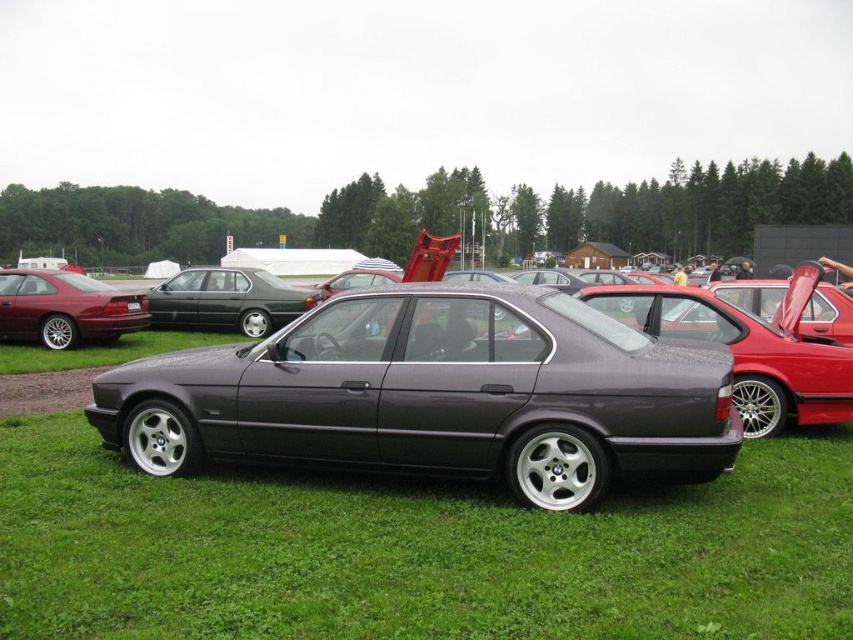
Question: Is satin metallic sedan at center to the right of satin black sedan at center from the viewer's perspective?

Choices:
 (A) yes
 (B) no

Answer: (A)

Question: Does shiny red car at left have a larger size compared to satin black sedan at center?

Choices:
 (A) no
 (B) yes

Answer: (A)

Question: Which object is the closest to the shiny red car at left?

Choices:
 (A) satin black sedan at center
 (B) satin metallic sedan at center

Answer: (A)

Question: Which object is closer to the camera taking this photo?

Choices:
 (A) satin metallic sedan at center
 (B) satin black sedan at center

Answer: (A)

Question: Does shiny red car at left appear on the right side of satin black sedan at center?

Choices:
 (A) yes
 (B) no

Answer: (B)

Question: Which is farther from the satin metallic sedan at center?

Choices:
 (A) shiny red car at left
 (B) satin black sedan at center

Answer: (B)